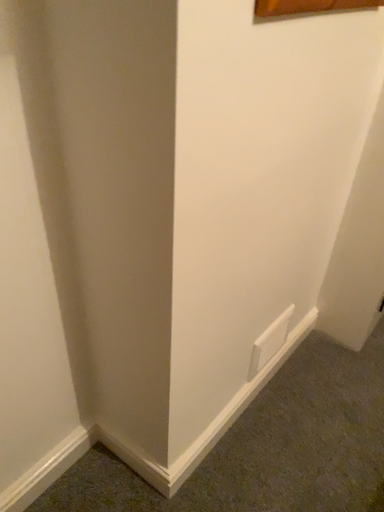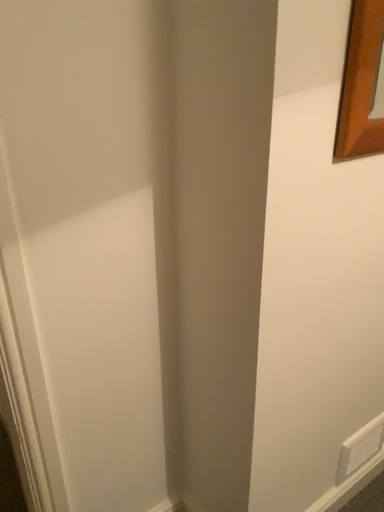
Question: How did the camera likely rotate when shooting the video?

Choices:
 (A) rotated upward
 (B) rotated downward

Answer: (A)